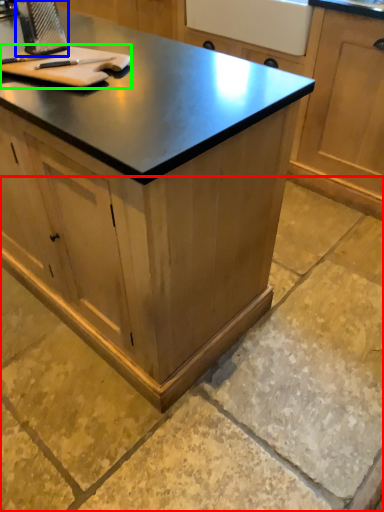
Question: Based on their relative distances, which object is farther from concrete (highlighted by a red box)? Choose from appliance (highlighted by a blue box) and cutting board (highlighted by a green box).

Choices:
 (A) appliance
 (B) cutting board

Answer: (A)